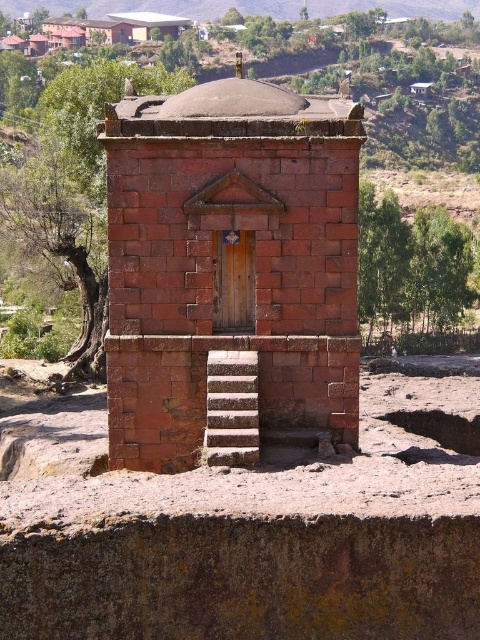
Question: Can you confirm if red brick chapel at center is positioned above red brick wall at upper center?

Choices:
 (A) yes
 (B) no

Answer: (B)

Question: Among these points, which one is farthest from the camera?

Choices:
 (A) (80, 6)
 (B) (220, 372)

Answer: (A)

Question: Can you confirm if red brick wall at upper center is thinner than white stone stairs at center?

Choices:
 (A) no
 (B) yes

Answer: (A)

Question: Which of these objects is positioned closest to the white stone stairs at center?

Choices:
 (A) red brick chapel at center
 (B) red brick wall at upper center

Answer: (A)

Question: Is red brick wall at upper center closer to camera compared to white stone stairs at center?

Choices:
 (A) yes
 (B) no

Answer: (B)

Question: Which object is the closest to the white stone stairs at center?

Choices:
 (A) red brick wall at upper center
 (B) red brick chapel at center

Answer: (B)